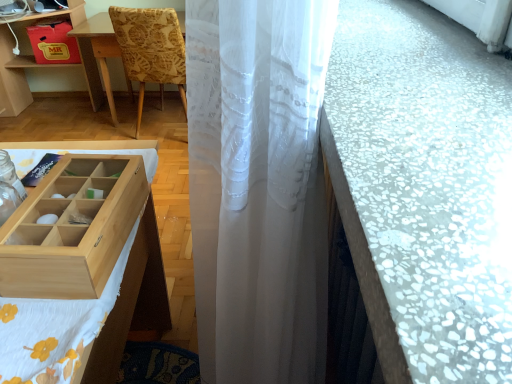
Measure the distance between point [385,322] and camera.

Point [385,322] is 29.40 centimeters away from camera.

Image resolution: width=512 pixels, height=384 pixels. What do you see at coordinates (53, 43) in the screenshot? I see `matte cardboard drawer at upper left` at bounding box center [53, 43].

I want to click on patterned fabric chair at upper left, so click(x=150, y=50).

This screenshot has width=512, height=384. Describe the element at coordinates (72, 228) in the screenshot. I see `light wood/wooden box at lower left` at that location.

Locate an element on the screen. This screenshot has height=384, width=512. wooden table at left is located at coordinates (36, 63).

Between white fabric at left and matte cardboard drawer at upper left, which one has more height?

Standing taller between the two is white fabric at left.

Is white fabric at left facing towards matte cardboard drawer at upper left?

No, white fabric at left is not aimed at matte cardboard drawer at upper left.

There is a white fabric at left. Where is `drawer above it (from a real-world perspective)`? The width and height of the screenshot is (512, 384). drawer above it (from a real-world perspective) is located at coordinates (53, 43).

From a real-world perspective, which is physically above, white fabric at left or matte cardboard drawer at upper left?

matte cardboard drawer at upper left, from a real-world perspective.

From a real-world perspective, between matte cardboard drawer at upper left and patterned fabric chair at upper left, who is vertically lower?

patterned fabric chair at upper left.

Based on the photo, considering the relative positions of matte cardboard drawer at upper left and patterned fabric chair at upper left in the image provided, is matte cardboard drawer at upper left in front of patterned fabric chair at upper left?

No, the depth of matte cardboard drawer at upper left is greater than that of patterned fabric chair at upper left.

Is matte cardboard drawer at upper left located outside patterned fabric chair at upper left?

Yes, matte cardboard drawer at upper left is located beyond the bounds of patterned fabric chair at upper left.

Is light wood/wooden box at lower left far from patterned fabric chair at upper left?

Yes, light wood/wooden box at lower left is far from patterned fabric chair at upper left.

Is light wood/wooden box at lower left shorter than patterned fabric chair at upper left?

Indeed, light wood/wooden box at lower left has a lesser height compared to patterned fabric chair at upper left.

Is light wood/wooden box at lower left to the left or to the right of patterned fabric chair at upper left in the image?

In the image, light wood/wooden box at lower left appears on the right side of patterned fabric chair at upper left.

Is light wood/wooden box at lower left aimed at patterned fabric chair at upper left?

No, light wood/wooden box at lower left is not facing towards patterned fabric chair at upper left.

Where is `tablecloth that is under the patterned fabric chair at upper left (from a real-world perspective)`? tablecloth that is under the patterned fabric chair at upper left (from a real-world perspective) is located at coordinates (86, 319).

How much distance is there between white fabric at left and patterned fabric chair at upper left?

A distance of 1.60 meters exists between white fabric at left and patterned fabric chair at upper left.

Who is shorter, white fabric at left or patterned fabric chair at upper left?

white fabric at left.

Considering the sizes of objects white fabric at left and patterned fabric chair at upper left in the image provided, who is thinner, white fabric at left or patterned fabric chair at upper left?

white fabric at left.

What's the angular difference between patterned fabric chair at upper left and light wood/wooden box at lower left's facing directions?

98.3 degrees.

From the image's perspective, which is below, patterned fabric chair at upper left or light wood/wooden box at lower left?

light wood/wooden box at lower left.

How distant is patterned fabric chair at upper left from light wood/wooden box at lower left?

patterned fabric chair at upper left and light wood/wooden box at lower left are 5.97 feet apart from each other.

Between patterned fabric chair at upper left and light wood/wooden box at lower left, which one appears on the right side from the viewer's perspective?

From the viewer's perspective, light wood/wooden box at lower left appears more on the right side.

From the image's perspective, which one is positioned higher, wooden table at left or white mosaic tile counter top at right?

wooden table at left, from the image's perspective.

Consider the image. Based on their sizes in the image, would you say wooden table at left is bigger or smaller than white mosaic tile counter top at right?

Clearly, wooden table at left is larger in size than white mosaic tile counter top at right.

From a real-world perspective, is wooden table at left under white mosaic tile counter top at right?

Yes, from a real-world perspective, wooden table at left is below white mosaic tile counter top at right.

Is wooden table at left next to white mosaic tile counter top at right?

No, wooden table at left is not in contact with white mosaic tile counter top at right.

Could you tell me if wooden table at left is turned towards light wood/wooden box at lower left?

No, wooden table at left is not turned towards light wood/wooden box at lower left.

How many degrees apart are the facing directions of wooden table at left and light wood/wooden box at lower left?

The angular difference between wooden table at left and light wood/wooden box at lower left is 93.2 degrees.

Can you confirm if wooden table at left is shorter than light wood/wooden box at lower left?

No, wooden table at left is not shorter than light wood/wooden box at lower left.

Between wooden table at left and light wood/wooden box at lower left, which one has smaller size?

With smaller size is light wood/wooden box at lower left.

The height and width of the screenshot is (384, 512). Find the location of `drawer that is on the left side of white fabric at left`. drawer that is on the left side of white fabric at left is located at coordinates (53, 43).

The image size is (512, 384). I want to click on drawer behind the patterned fabric chair at upper left, so click(x=53, y=43).

From the image, which object appears to be nearer to white fabric at left, matte cardboard drawer at upper left or wooden table at left?

wooden table at left is closer to white fabric at left.

From the image, which object appears to be nearer to wooden table at left, light wood/wooden box at lower left or patterned fabric chair at upper left?

Among the two, patterned fabric chair at upper left is located nearer to wooden table at left.

From the image, which object appears to be nearer to white fabric at left, wooden table at left or white mosaic tile counter top at right?

The object closer to white fabric at left is white mosaic tile counter top at right.

From the image, which object appears to be nearer to light wood/wooden box at lower left, patterned fabric chair at upper left or wooden table at left?

patterned fabric chair at upper left.

Based on their spatial positions, is patterned fabric chair at upper left or white fabric at left closer to white mosaic tile counter top at right?

white fabric at left is closer to white mosaic tile counter top at right.

When comparing their distances from white mosaic tile counter top at right, does white fabric at left or matte cardboard drawer at upper left seem further?

matte cardboard drawer at upper left is positioned further to the anchor white mosaic tile counter top at right.

When comparing their distances from matte cardboard drawer at upper left, does white mosaic tile counter top at right or patterned fabric chair at upper left seem closer?

patterned fabric chair at upper left lies closer to matte cardboard drawer at upper left than the other object.

Based on their spatial positions, is matte cardboard drawer at upper left or light wood/wooden box at lower left further from white sheer curtain at center?

matte cardboard drawer at upper left.

Where is `tablecloth between white mosaic tile counter top at right and matte cardboard drawer at upper left in the front-back direction`? tablecloth between white mosaic tile counter top at right and matte cardboard drawer at upper left in the front-back direction is located at coordinates (86, 319).

The height and width of the screenshot is (384, 512). What are the coordinates of `box between white sheer curtain at center and wooden table at left in the front-back direction` in the screenshot? It's located at (72, 228).

At what (x,y) coordinates should I click in order to perform the action: click on box positioned between white sheer curtain at center and matte cardboard drawer at upper left from near to far. Please return your answer as a coordinate pair (x, y). Image resolution: width=512 pixels, height=384 pixels. Looking at the image, I should click on (72, 228).

Find the location of `table located between light wood/wooden box at lower left and matte cardboard drawer at upper left in the depth direction`. table located between light wood/wooden box at lower left and matte cardboard drawer at upper left in the depth direction is located at coordinates (36, 63).